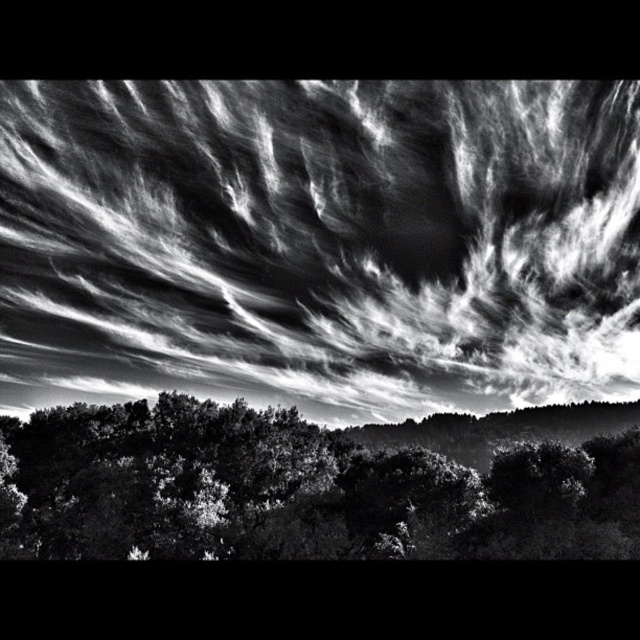
You are a photographer analyzing this black and white photo. You notice a point at coordinates (321, 243). Based on the scene description, what object in the image does this point most likely belong to?

The point at (321, 243) is on white textured clouds at upper center.

You are observing the dramatic sky scene in the black and white photograph. There are two points marked in the image, point [253,148] and point [333,524]. From your perspective, which point is closer to you?

Point [333,524] is closer to you because the Objects Description states that point [253,148] is behind point [333,524].

Based on the photo, you are an airplane passenger looking out the window and see the white textured clouds at upper center and the dense foliage at bottom. Which object is higher in the sky?

The white textured clouds at upper center are higher in the sky than the dense foliage at bottom because they are positioned over it.